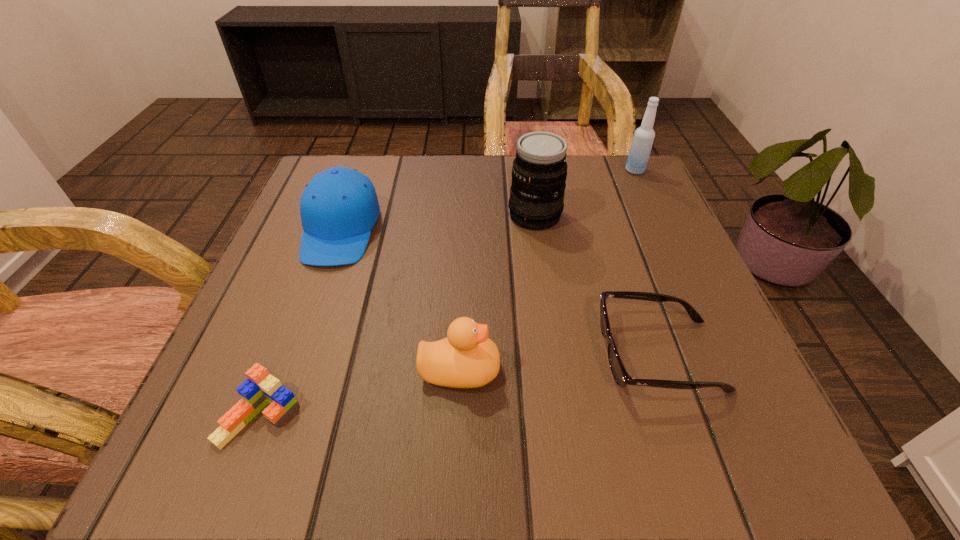
Where is `vacant space that is in between the third object from left to right and the bottle`? This screenshot has height=540, width=960. vacant space that is in between the third object from left to right and the bottle is located at coordinates click(x=547, y=270).

Select which object appears as the third closest to the Lego. Please provide its 2D coordinates. Your answer should be formatted as a tuple, i.e. [(x, y)], where the tuple contains the x and y coordinates of a point satisfying the conditions above.

[(622, 378)]

What are the coordinates of `object that is the closest to the Lego` in the screenshot? It's located at (466, 358).

This screenshot has height=540, width=960. Find the location of `free space in the image that satisfies the following two spatial constraints: 1. on the front side of the bottle; 2. on the lenses of the spectacles`. free space in the image that satisfies the following two spatial constraints: 1. on the front side of the bottle; 2. on the lenses of the spectacles is located at coordinates (720, 355).

I want to click on vacant point that satisfies the following two spatial constraints: 1. on the front side of the third object from right to left; 2. on the face of the third object from left to right, so click(557, 369).

This screenshot has width=960, height=540. I want to click on free location that satisfies the following two spatial constraints: 1. on the back side of the Lego; 2. on the right side of the fourth object from left to right, so click(336, 215).